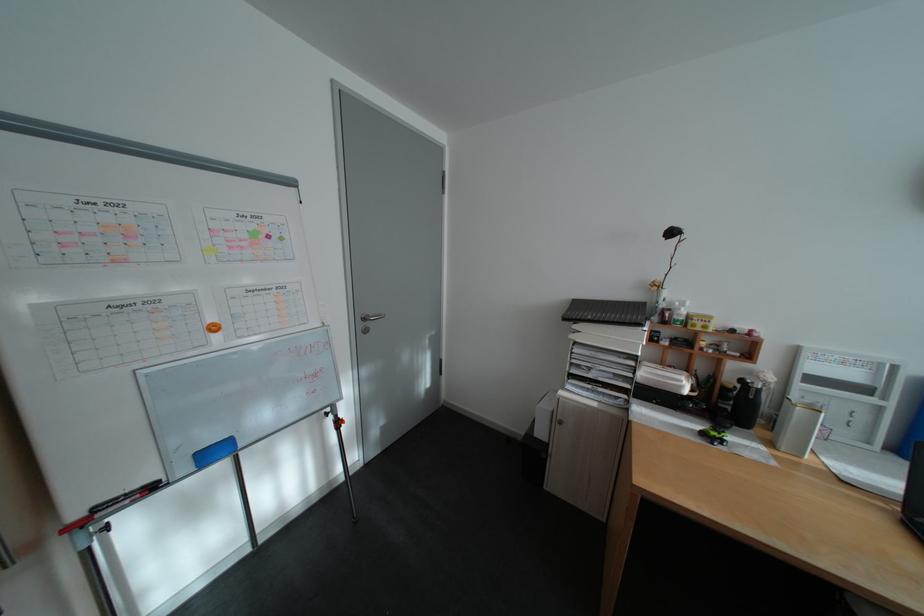
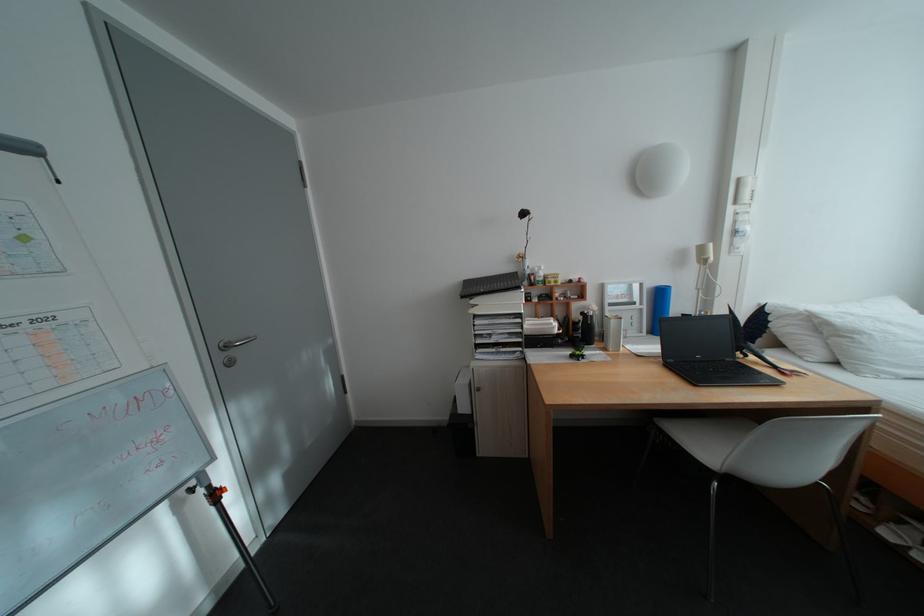
Question: In a continuous first-person perspective shot, in which direction is the camera moving?

Choices:
 (A) Left
 (B) Right
 (C) Forward
 (D) Backward

Answer: (A)